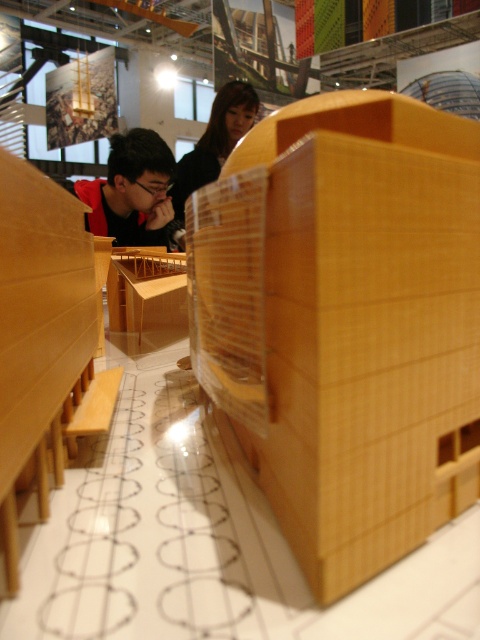
You are standing in front of the architectural model and notice a person wearing a matte black shirt at left. Where exactly is this person positioned relative to the model?

The matte black shirt at left is located at point 0.298 along the horizontal axis and 0.275 along the vertical axis relative to the model.

You are standing at the camera position and want to hand a brochure to the person wearing the matte black shirt at left. Can you reach them without moving from your current position?

The matte black shirt at left is 1.75 meters away from the camera. Since the average human arm length is about 0.7 meters, you cannot reach them without moving from your current position.

You are an artist trying to replicate the scene. You need to know which object is wider between the matte black shirt at left and the black hair at upper center to ensure proportions are accurate. Which one is wider?

The matte black shirt at left is wider than the black hair at upper center according to the description.